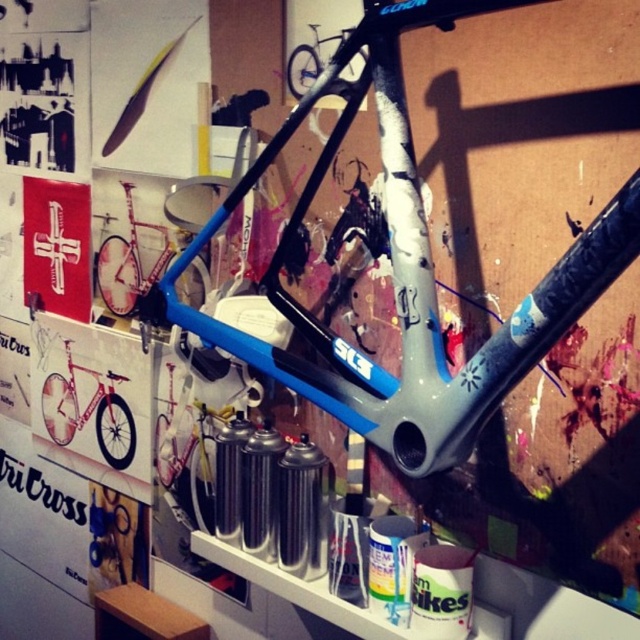
Does matte blue frame at center appear on the left side of shiny silver bicycle at upper center?

Correct, you'll find matte blue frame at center to the left of shiny silver bicycle at upper center.

Who is more distant from viewer, (131, 192) or (298, 58)?

The point (131, 192) is more distant.

This screenshot has width=640, height=640. Find the location of `matte blue frame at center`. matte blue frame at center is located at coordinates (131, 262).

Is shiny red bicycle at left bigger than shiny silver bicycle at upper center?

Indeed, shiny red bicycle at left has a larger size compared to shiny silver bicycle at upper center.

Who is more forward, (109, 380) or (310, 44)?

Point (310, 44) is more forward.

What do you see at coordinates (90, 410) in the screenshot? I see `shiny red bicycle at left` at bounding box center [90, 410].

Where is `shiny red bicycle at left`? shiny red bicycle at left is located at coordinates pyautogui.click(x=90, y=410).

Is shiny red bicycle at left to the left of matte blue frame at center from the viewer's perspective?

Yes, shiny red bicycle at left is to the left of matte blue frame at center.

Who is more distant from viewer, (42, 394) or (132, 300)?

Point (42, 394)

Find the location of a particular element. Image resolution: width=640 pixels, height=640 pixels. shiny red bicycle at left is located at coordinates coord(90,410).

Where is `shiny red bicycle at left`? Image resolution: width=640 pixels, height=640 pixels. shiny red bicycle at left is located at coordinates (90, 410).